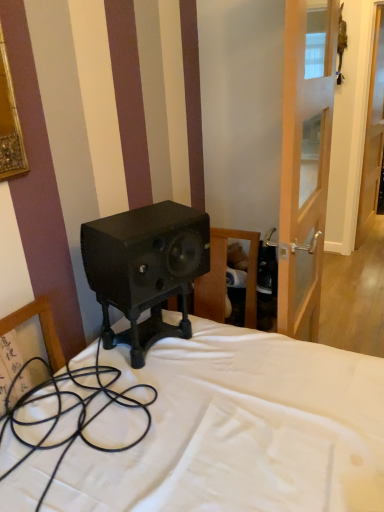
What is the approximate height of transparent glass door at right?

1.97 meters.

Describe the element at coordinates (145, 269) in the screenshot. I see `matte black speaker at center` at that location.

In order to face black rubber cable at lower left, should I rotate leftwards or rightwards?

Rotate your view left by about 16.625°.

The height and width of the screenshot is (512, 384). What are the coordinates of `transparent glass door at right` in the screenshot? It's located at (373, 136).

You are a GUI agent. You are given a task and a screenshot of the screen. Output one action in this format:
    pyautogui.click(x=<x>, y=<y>)
    Task: Click on the door located behind the black rubber cable at lower left
    
    Given the screenshot: What is the action you would take?
    pyautogui.click(x=373, y=136)

Does point (93, 445) lie in front of point (375, 59)?

Yes, point (93, 445) is closer to viewer.

Which object is closer to the camera taking this photo, black rubber cable at lower left or transparent glass door at right?

black rubber cable at lower left is in front.

Is black rubber cable at lower left at the right side of transparent glass door at right?

In fact, black rubber cable at lower left is to the left of transparent glass door at right.

Are black rubber cable at lower left and matte black speaker at center making contact?

No, black rubber cable at lower left is not in contact with matte black speaker at center.

Which of these two, black rubber cable at lower left or matte black speaker at center, stands taller?

With more height is black rubber cable at lower left.

Who is more distant, black rubber cable at lower left or matte black speaker at center?

matte black speaker at center.

Is point (198, 240) less distant than point (373, 85)?

Yes.

Which object is closer to the camera, matte black speaker at center or transparent glass door at right?

matte black speaker at center is closer to the camera.

Is matte black speaker at center positioned with its back to transparent glass door at right?

No.

From the image's perspective, between transparent glass door at right and matte black speaker at center, which one is located above?

transparent glass door at right appears higher in the image.

From a real-world perspective, is transparent glass door at right below matte black speaker at center?

No, from a real-world perspective, transparent glass door at right is not under matte black speaker at center.

Does point (361, 196) come farther from viewer compared to point (129, 261)?

Yes, point (361, 196) is behind point (129, 261).

From the image's perspective, does transparent glass door at right appear lower than black rubber cable at lower left?

No.

Is transparent glass door at right thinner than black rubber cable at lower left?

Correct, the width of transparent glass door at right is less than that of black rubber cable at lower left.

Considering the positions of objects transparent glass door at right and black rubber cable at lower left in the image provided, who is more to the left, transparent glass door at right or black rubber cable at lower left?

black rubber cable at lower left is more to the left.

From a real-world perspective, which is physically below, matte black speaker at center or black rubber cable at lower left?

black rubber cable at lower left.

Considering the sizes of objects matte black speaker at center and black rubber cable at lower left in the image provided, who is wider, matte black speaker at center or black rubber cable at lower left?

black rubber cable at lower left.

Which object is closer to the camera taking this photo, matte black speaker at center or black rubber cable at lower left?

Positioned in front is black rubber cable at lower left.

How different are the orientations of matte black speaker at center and black rubber cable at lower left in degrees?

There is a 18.6-degree angle between the facing directions of matte black speaker at center and black rubber cable at lower left.

Image resolution: width=384 pixels, height=512 pixels. Find the location of `door lying on the right of black rubber cable at lower left`. door lying on the right of black rubber cable at lower left is located at coordinates (373, 136).

Locate an element on the screen. loudspeaker above the black rubber cable at lower left (from the image's perspective) is located at coordinates tap(145, 269).

Based on their spatial positions, is transparent glass door at right or matte black speaker at center further from black rubber cable at lower left?

transparent glass door at right.

Estimate the real-world distances between objects in this image. Which object is closer to black rubber cable at lower left, matte black speaker at center or transparent glass door at right?

matte black speaker at center.

Looking at the image, which one is located closer to matte black speaker at center, transparent glass door at right or black rubber cable at lower left?

Based on the image, black rubber cable at lower left appears to be nearer to matte black speaker at center.

Estimate the real-world distances between objects in this image. Which object is closer to transparent glass door at right, matte black speaker at center or black rubber cable at lower left?

The object closer to transparent glass door at right is matte black speaker at center.

When comparing their distances from matte black speaker at center, does black rubber cable at lower left or transparent glass door at right seem further?

transparent glass door at right.

Based on their spatial positions, is black rubber cable at lower left or matte black speaker at center further from transparent glass door at right?

Based on the image, black rubber cable at lower left appears to be further to transparent glass door at right.

Image resolution: width=384 pixels, height=512 pixels. In order to click on loudspeaker located between black rubber cable at lower left and transparent glass door at right in the depth direction in this screenshot , I will do `click(145, 269)`.